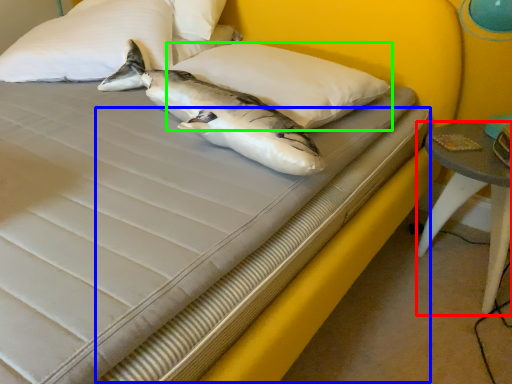
Question: Which is nearer to the table (highlighted by a red box)? bed frame (highlighted by a blue box) or pillow (highlighted by a green box).

Choices:
 (A) bed frame
 (B) pillow

Answer: (A)